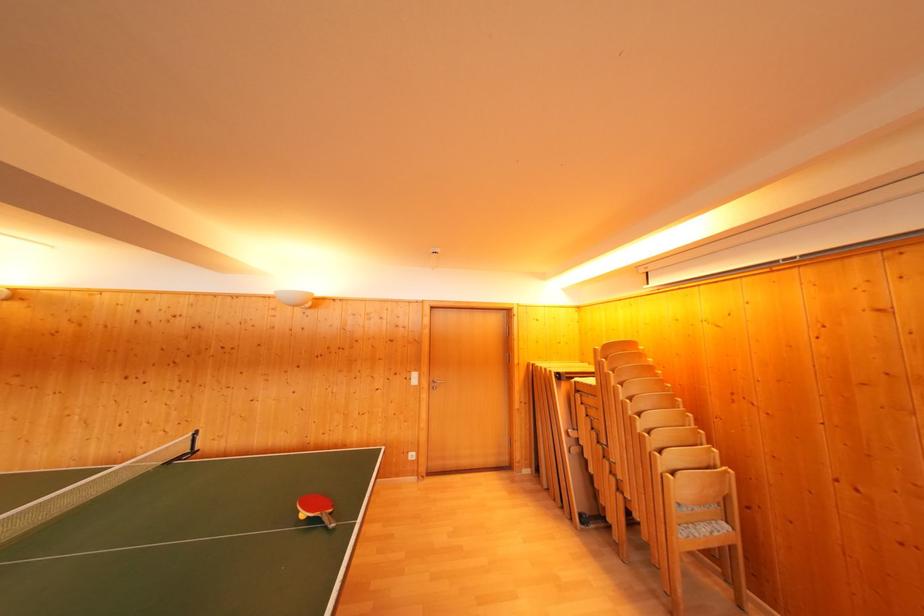
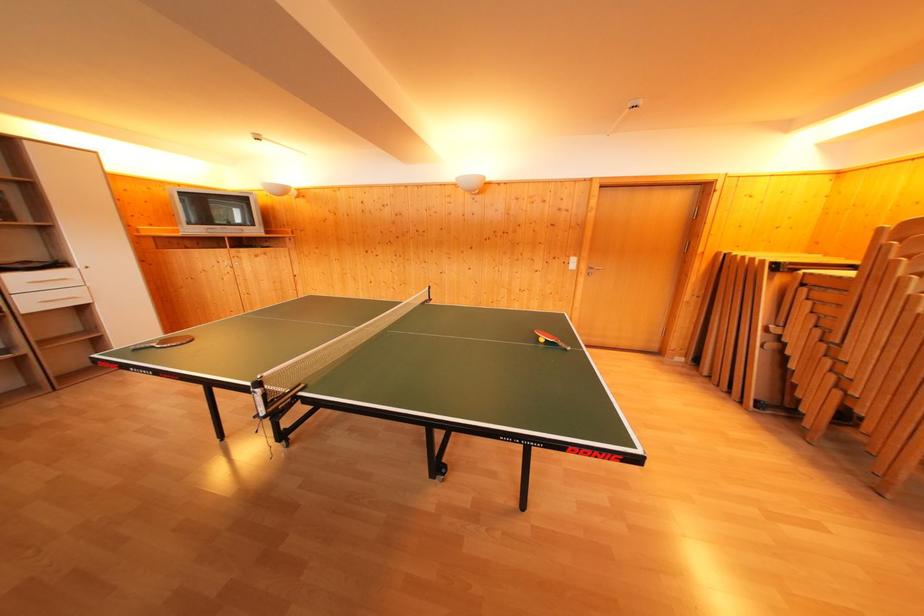
Where in the second image is the point corresponding to point (330, 524) from the first image?

(565, 350)